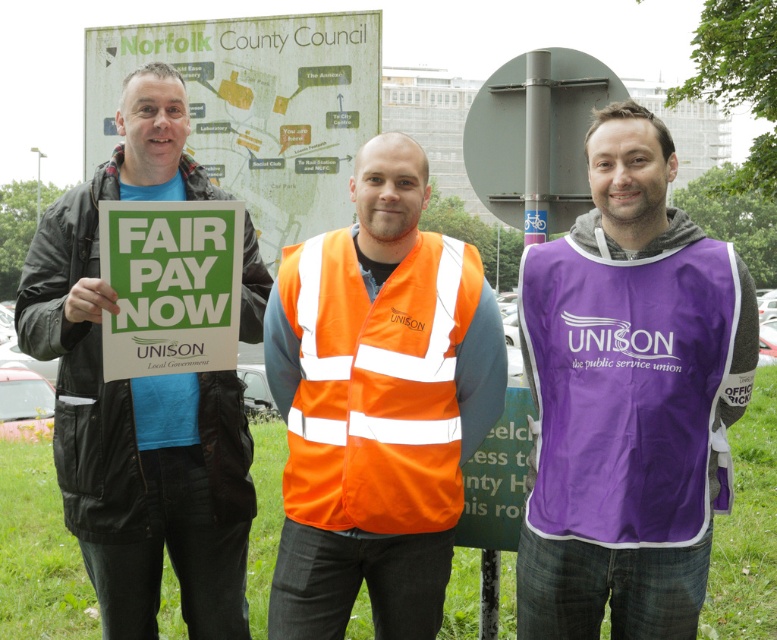
Based on the photo, you are a pedestrian trying to cross the road where the purple fabric vest at center and orange reflective safety vest at center are standing. Which vest will be more visible to drivers approaching from the front?

The orange reflective safety vest at center is more visible to drivers because reflective materials enhance visibility, especially in low light conditions, whereas the purple fabric vest at center, though larger, does not have reflective properties mentioned in the scene description.

You are a pedestrian trying to cross the road and notice two people nearby. One is wearing a purple fabric vest at center and the other is wearing a matte black jacket at left. Which clothing item appears narrower from your perspective?

The purple fabric vest at center appears narrower than the matte black jacket at left because it has a lesser width compared to the matte black jacket at left.

In the scene shown: Based on the scene description, what is located at the coordinates point (138,401)?

The point (138,401) is where the matte black jacket at left is located.